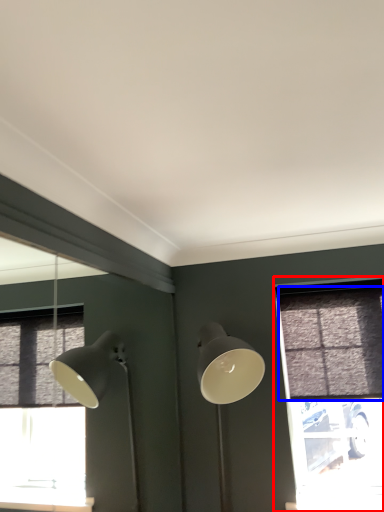
Question: Among these objects, which one is nearest to the camera, window (highlighted by a red box) or curtain (highlighted by a blue box)?

Choices:
 (A) window
 (B) curtain

Answer: (B)